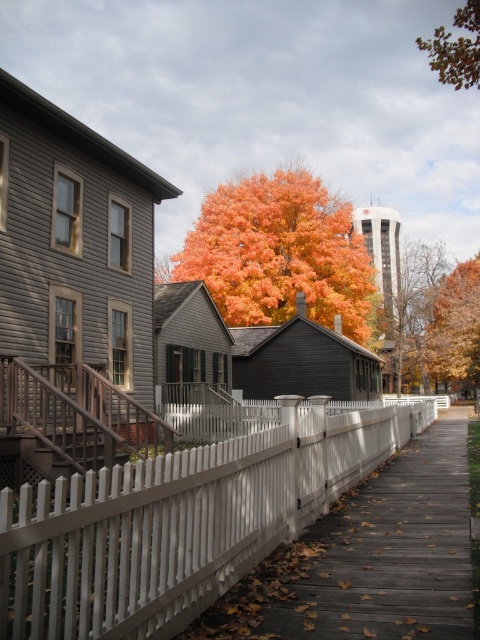
Question: Which object appears farthest from the camera in this image?

Choices:
 (A) white picket fence at center
 (B) brown leafy tree at upper right
 (C) orange leafy tree at center

Answer: (C)

Question: Is orange leafy tree at center below brown leafy tree at upper right?

Choices:
 (A) yes
 (B) no

Answer: (A)

Question: Which point is farther to the camera?

Choices:
 (A) (479, 380)
 (B) (122, 625)

Answer: (A)

Question: Which point is closer to the camera?

Choices:
 (A) white picket fence at center
 (B) brown leafy tree at upper right

Answer: (A)

Question: Does white picket fence at center appear on the left side of brown leafy tree at upper right?

Choices:
 (A) yes
 (B) no

Answer: (A)

Question: Does white picket fence at center lie behind brown leafy tree at upper right?

Choices:
 (A) yes
 (B) no

Answer: (B)